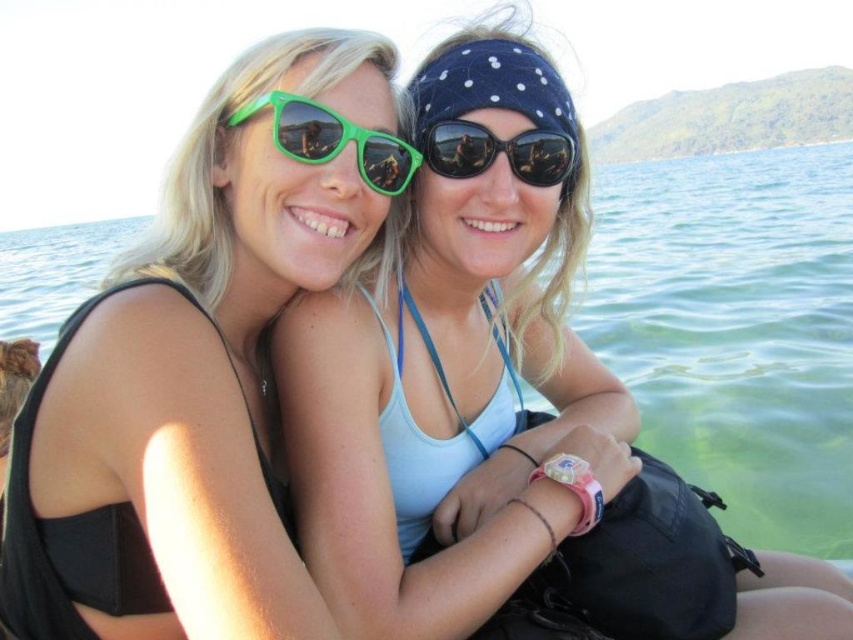
Question: Which point is farther to the camera?

Choices:
 (A) (279, 99)
 (B) (4, 330)
 (C) (178, 609)
 (D) (440, 433)

Answer: (B)

Question: Considering the real-world distances, which object is farthest from the green translucent water at center?

Choices:
 (A) black reflective sunglasses at center
 (B) matte green sunglasses at upper left

Answer: (B)

Question: Does green plastic sunglasses at center have a lesser width compared to black reflective sunglasses at center?

Choices:
 (A) no
 (B) yes

Answer: (A)

Question: Which point appears farthest from the camera in this image?

Choices:
 (A) (56, 266)
 (B) (833, 493)
 (C) (331, 156)

Answer: (A)

Question: Can you confirm if green translucent water at center is positioned to the right of green plastic sunglasses at center?

Choices:
 (A) no
 (B) yes

Answer: (B)

Question: Can you confirm if matte green sunglasses at upper left is positioned to the left of green plastic sunglasses at center?

Choices:
 (A) yes
 (B) no

Answer: (A)